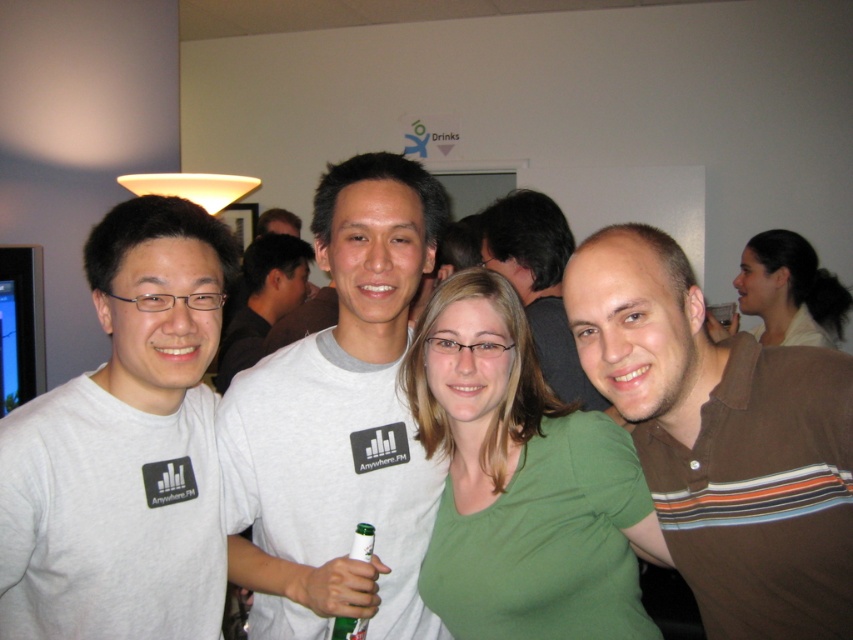
You are standing in the same room as the group and want to take a photo of both point (x=122, y=244) and point (x=343, y=624). Will both points be in focus if you focus on the closer one?

Yes, because point (x=122, y=244) is closer to the camera than point (x=343, y=624), so focusing on the closer point will ensure both are in focus if the depth of field is sufficient.

You are at a social event and want to find the person wearing the green matte shirt at center. Which direction should you look relative to the brown striped polo shirt at right?

The brown striped polo shirt at right is above the green matte shirt at center. So, you should look downward from the brown striped polo shirt at right to find the green matte shirt at center.